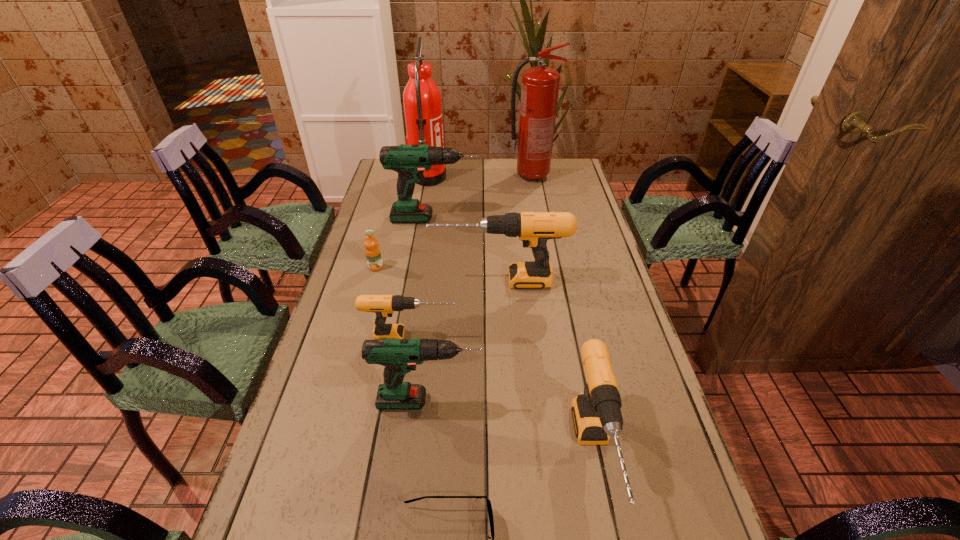
What are the coordinates of `free space that is in between the nearer green drill and the red fire extinguisher` in the screenshot? It's located at (480, 289).

Where is `vacant area between the fifth farthest object and the left fire extinguisher`? The image size is (960, 540). vacant area between the fifth farthest object and the left fire extinguisher is located at coordinates (464, 230).

Identify which object is the second closest to the fourth nearest drill. Please provide its 2D coordinates. Your answer should be formatted as a tuple, i.e. [(x, y)], where the tuple contains the x and y coordinates of a point satisfying the conditions above.

[(372, 250)]

At what (x,y) coordinates should I click in order to perform the action: click on object that can be found as the fourth closest to the smaller green drill. Please return your answer as a coordinate pair (x, y). This screenshot has height=540, width=960. Looking at the image, I should click on (534, 229).

Find the location of `drill that can be found as the fifth closest to the sixth nearest object`. drill that can be found as the fifth closest to the sixth nearest object is located at coordinates (596, 413).

Point out which drill is positioned as the nearest to the orange juice. Please provide its 2D coordinates. Your answer should be formatted as a tuple, i.e. [(x, y)], where the tuple contains the x and y coordinates of a point satisfying the conditions above.

[(534, 229)]

Locate which black drill ranks in proximity to the second biggest black drill. Please provide its 2D coordinates. Your answer should be formatted as a tuple, i.e. [(x, y)], where the tuple contains the x and y coordinates of a point satisfying the conditions above.

[(384, 306)]

Where is `black drill that is the third closest one to the left fire extinguisher`? The image size is (960, 540). black drill that is the third closest one to the left fire extinguisher is located at coordinates (596, 413).

This screenshot has height=540, width=960. Find the location of `vacant position in the image that satisfies the following two spatial constraints: 1. on the label side of the left fire extinguisher; 2. on the label of the sixth nearest object`. vacant position in the image that satisfies the following two spatial constraints: 1. on the label side of the left fire extinguisher; 2. on the label of the sixth nearest object is located at coordinates (412, 267).

I want to click on vacant space that satisfies the following two spatial constraints: 1. on the handle side the red fire extinguisher; 2. on the label of the orange juice, so click(548, 267).